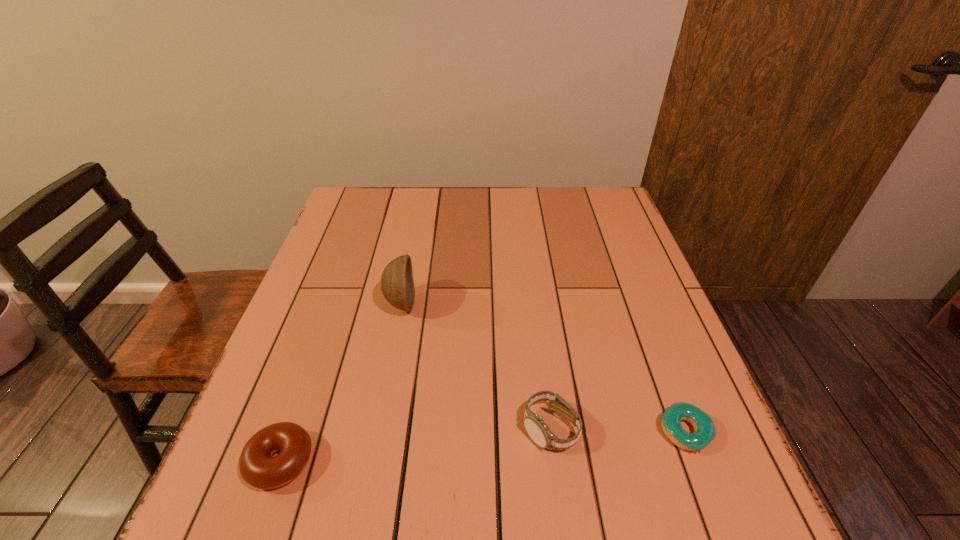
Locate an element on the screen. This screenshot has height=540, width=960. vacant region located on the right of the leftmost object is located at coordinates (404, 461).

At what (x,y) coordinates should I click in order to perform the action: click on vacant space situated on the left of the shorter doughnut. Please return your answer as a coordinate pair (x, y). Looking at the image, I should click on (444, 432).

Locate an element on the screen. The image size is (960, 540). object that is at the near edge is located at coordinates (258, 468).

Locate an element on the screen. object positioned at the left edge is located at coordinates (258, 468).

You are a GUI agent. You are given a task and a screenshot of the screen. Output one action in this format:
    pyautogui.click(x=<x>, y=<y>)
    Task: Click on the object that is positioned at the right edge
    The height and width of the screenshot is (540, 960).
    Given the screenshot: What is the action you would take?
    pyautogui.click(x=705, y=432)

Locate an element on the screen. object positioned at the near left corner is located at coordinates (258, 468).

Find the location of a particular element. The height and width of the screenshot is (540, 960). vacant space at the far edge is located at coordinates (399, 209).

Image resolution: width=960 pixels, height=540 pixels. In the image, there is a desktop. In order to click on free region at the near edge in this screenshot , I will do `click(493, 513)`.

I want to click on blank space at the left edge, so click(310, 320).

This screenshot has height=540, width=960. Identify the location of vacant space at the right edge. (667, 458).